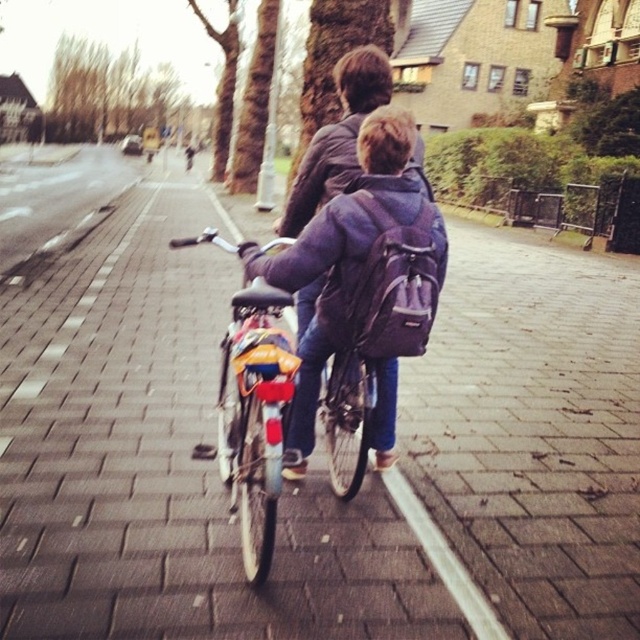
Question: Does metallic silver bicycle at center have a larger size compared to purple fabric backpack at center?

Choices:
 (A) yes
 (B) no

Answer: (B)

Question: Which point is farther to the camera?

Choices:
 (A) metallic silver bicycle at center
 (B) purple fabric backpack at center

Answer: (B)

Question: Does metallic silver bicycle at center appear over purple fabric backpack at center?

Choices:
 (A) no
 (B) yes

Answer: (A)

Question: Can you confirm if metallic silver bicycle at center is thinner than purple fabric backpack at center?

Choices:
 (A) yes
 (B) no

Answer: (A)

Question: Which object appears farthest from the camera in this image?

Choices:
 (A) purple fabric backpack at center
 (B) metallic silver bicycle at center

Answer: (A)